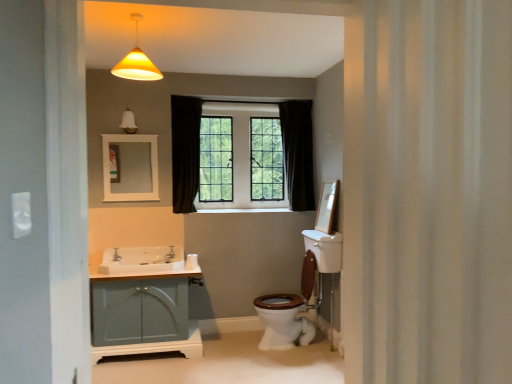
Identify the location of vacant area on top of matte teal cabinet at lower left (from a real-world perspective). (142, 264).